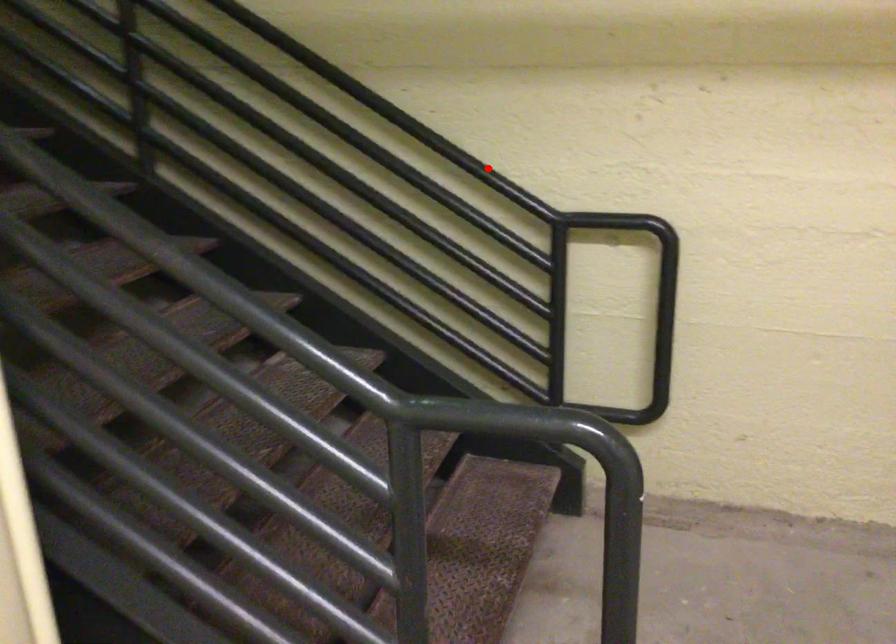
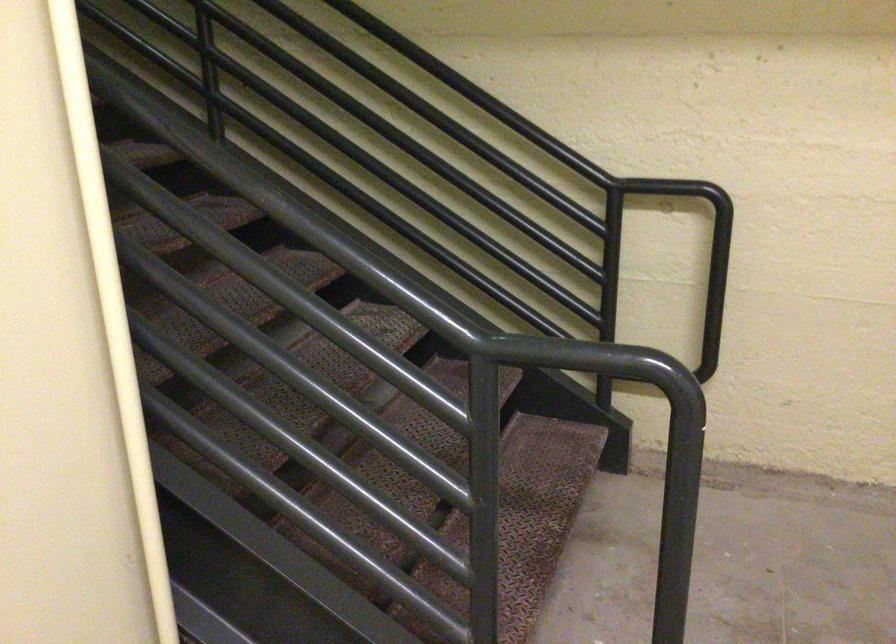
The point at the highlighted location is marked in the first image. Where is the corresponding point in the second image?

(546, 129)